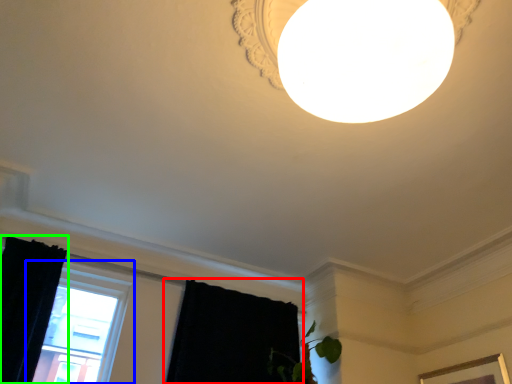
Question: Estimate the real-world distances between objects in this image. Which object is farther from curtain (highlighted by a red box), window (highlighted by a blue box) or curtain (highlighted by a green box)?

Choices:
 (A) window
 (B) curtain

Answer: (B)